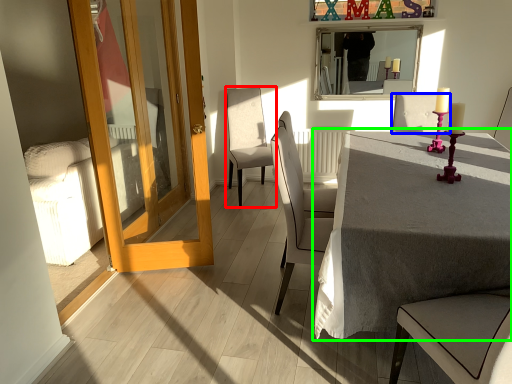
Question: Which object is the closest to the chair (highlighted by a red box)? Choose among these: chair (highlighted by a blue box) or table (highlighted by a green box).

Choices:
 (A) chair
 (B) table

Answer: (A)